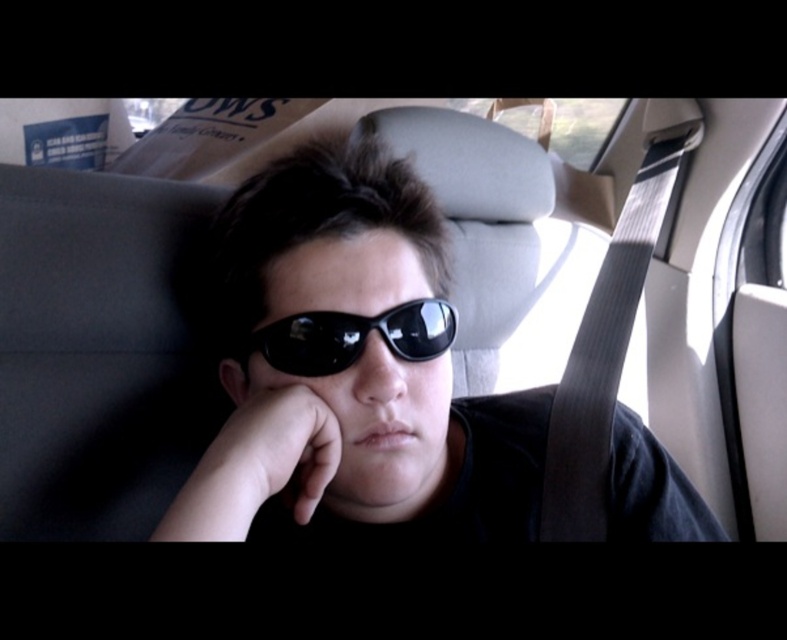
Question: Considering the relative positions of matte black sunglasses at center and black reflective sunglasses at center in the image provided, where is matte black sunglasses at center located with respect to black reflective sunglasses at center?

Choices:
 (A) below
 (B) above

Answer: (A)

Question: Does matte black sunglasses at center have a greater width compared to black reflective sunglasses at center?

Choices:
 (A) yes
 (B) no

Answer: (A)

Question: Is matte black sunglasses at center wider than black reflective sunglasses at center?

Choices:
 (A) yes
 (B) no

Answer: (A)

Question: Which is nearer to the skinny flesh-toned hand at center?

Choices:
 (A) black reflective sunglasses at center
 (B) matte black sunglasses at center

Answer: (A)

Question: Which point is closer to the camera?

Choices:
 (A) skinny flesh-toned hand at center
 (B) black reflective sunglasses at center
 (C) matte black sunglasses at center

Answer: (A)

Question: Which of the following is the closest to the observer?

Choices:
 (A) black reflective sunglasses at center
 (B) skinny flesh-toned hand at center
 (C) matte black sunglasses at center

Answer: (B)